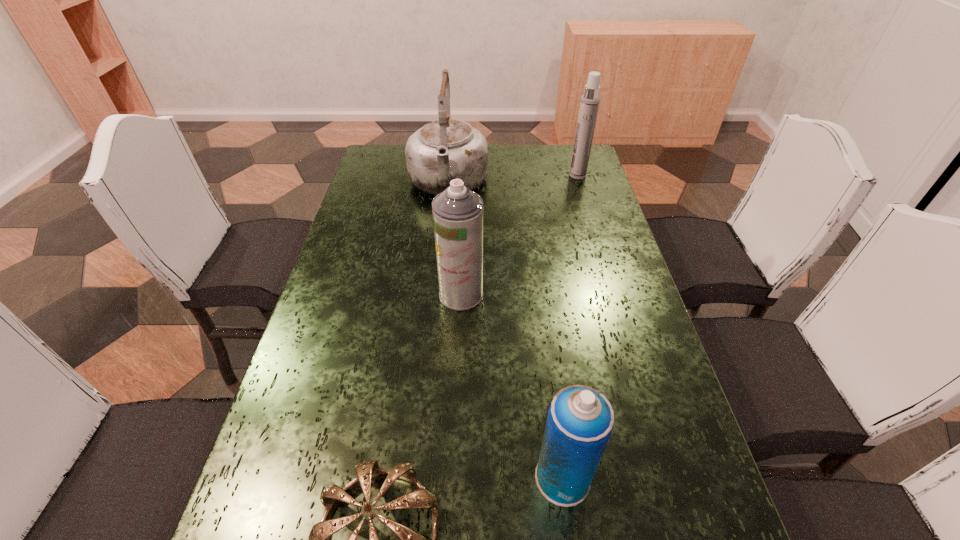
Identify the location of vacant position located on the back of the second shortest object. This screenshot has width=960, height=540. (540, 300).

This screenshot has height=540, width=960. In order to click on aerosol can present at the far edge in this screenshot , I will do `click(589, 104)`.

In order to click on kettle that is positioned at the far edge in this screenshot , I will do `click(447, 149)`.

The width and height of the screenshot is (960, 540). I want to click on object that is positioned at the right edge, so click(589, 104).

In order to click on object that is at the far right corner in this screenshot , I will do `click(589, 104)`.

This screenshot has height=540, width=960. In the image, there is a desktop. Identify the location of vacant region at the far edge. (542, 146).

In the image, there is a desktop. At what (x,y) coordinates should I click in order to perform the action: click on vacant space at the left edge. Please return your answer as a coordinate pair (x, y). Looking at the image, I should click on [x=350, y=288].

At what (x,y) coordinates should I click in order to perform the action: click on vacant space at the right edge of the desktop. Please return your answer as a coordinate pair (x, y). The height and width of the screenshot is (540, 960). Looking at the image, I should click on (635, 402).

The image size is (960, 540). Identify the location of vacant area at the far left corner. (397, 174).

Image resolution: width=960 pixels, height=540 pixels. I want to click on free location at the far right corner, so click(x=573, y=146).